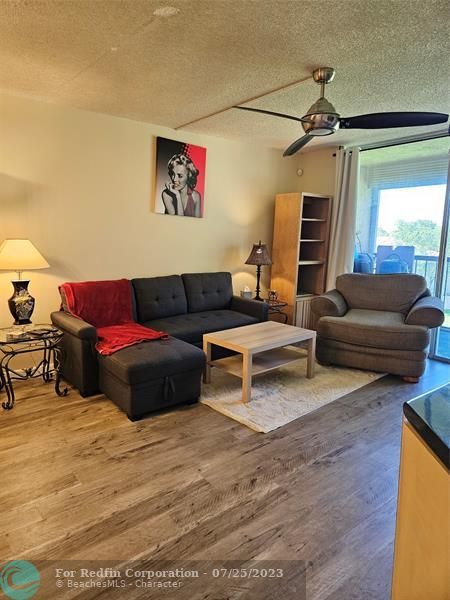
Image resolution: width=450 pixels, height=600 pixels. Find the location of `coffee table`. coffee table is located at coordinates (236, 355).